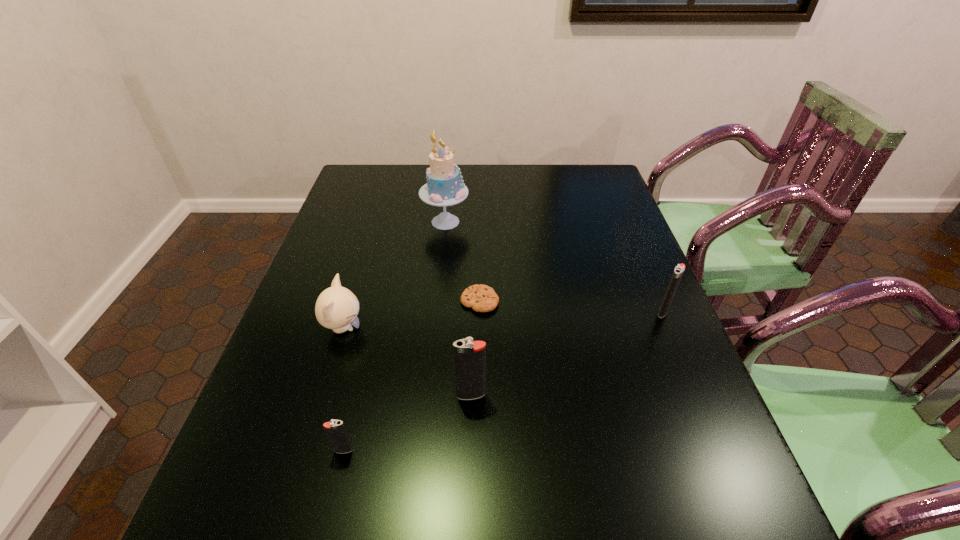
Identify the location of vacant space at the far edge. This screenshot has width=960, height=540. (561, 196).

Image resolution: width=960 pixels, height=540 pixels. What are the coordinates of `vacant space at the near edge of the desktop` in the screenshot? It's located at (484, 469).

You are a GUI agent. You are given a task and a screenshot of the screen. Output one action in this format:
    pyautogui.click(x=<x>, y=<y>)
    Task: Click on the free region at the left edge of the desktop
    This screenshot has height=540, width=960.
    Given the screenshot: What is the action you would take?
    pyautogui.click(x=364, y=208)

You are a GUI agent. You are given a task and a screenshot of the screen. Output one action in this format:
    pyautogui.click(x=<x>, y=<y>)
    Task: Click on the vacant space at the right edge
    The height and width of the screenshot is (540, 960).
    Given the screenshot: What is the action you would take?
    pyautogui.click(x=605, y=200)

Locate an element on the screen. Image resolution: width=960 pixels, height=540 pixels. vacant space at the far left corner of the desktop is located at coordinates (387, 198).

Identify the location of free location at the far right corner. The image size is (960, 540). (582, 186).

This screenshot has height=540, width=960. I want to click on empty space between the second tallest igniter and the tallest object, so click(x=555, y=267).

Where is `empty location between the leftmost igniter and the fifth farthest object`? The width and height of the screenshot is (960, 540). empty location between the leftmost igniter and the fifth farthest object is located at coordinates (407, 423).

Find the location of a particular element. The image size is (960, 540). free space between the leftmost object and the farthest object is located at coordinates (395, 275).

Locate an element on the screen. Image resolution: width=960 pixels, height=540 pixels. free space that is in between the shortest object and the fifth object from right to left is located at coordinates (412, 376).